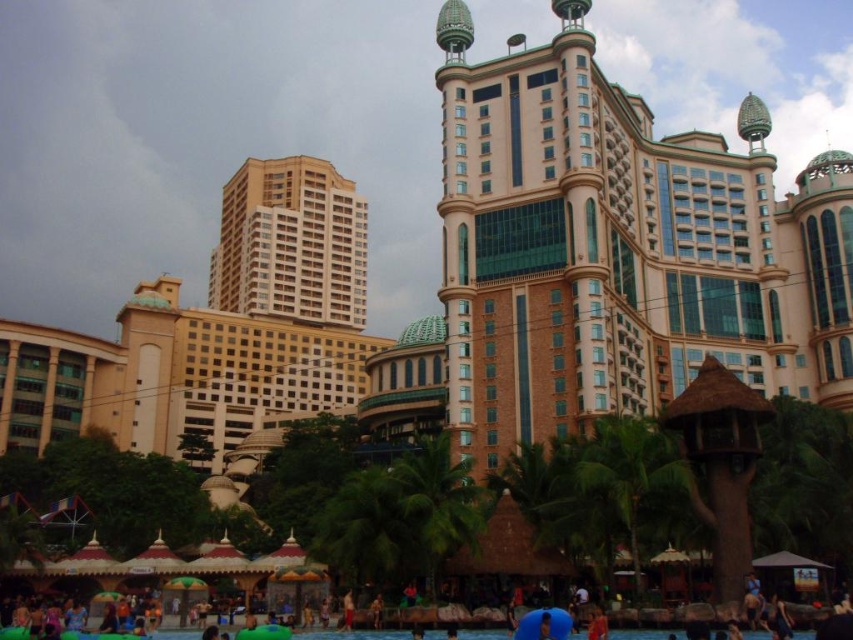
Question: Among these objects, which one is farthest from the camera?

Choices:
 (A) blue rubber pool at lower center
 (B) beige glass building at center

Answer: (B)

Question: Is beige glass building at center to the left of blue rubber pool at lower center from the viewer's perspective?

Choices:
 (A) yes
 (B) no

Answer: (A)

Question: Considering the relative positions of beige glass building at center and blue rubber pool at lower center in the image provided, where is beige glass building at center located with respect to blue rubber pool at lower center?

Choices:
 (A) below
 (B) above

Answer: (B)

Question: Can you confirm if beige glass building at center is positioned below blue rubber pool at lower center?

Choices:
 (A) no
 (B) yes

Answer: (A)

Question: Which of the following is the farthest from the observer?

Choices:
 (A) (236, 301)
 (B) (660, 634)

Answer: (A)